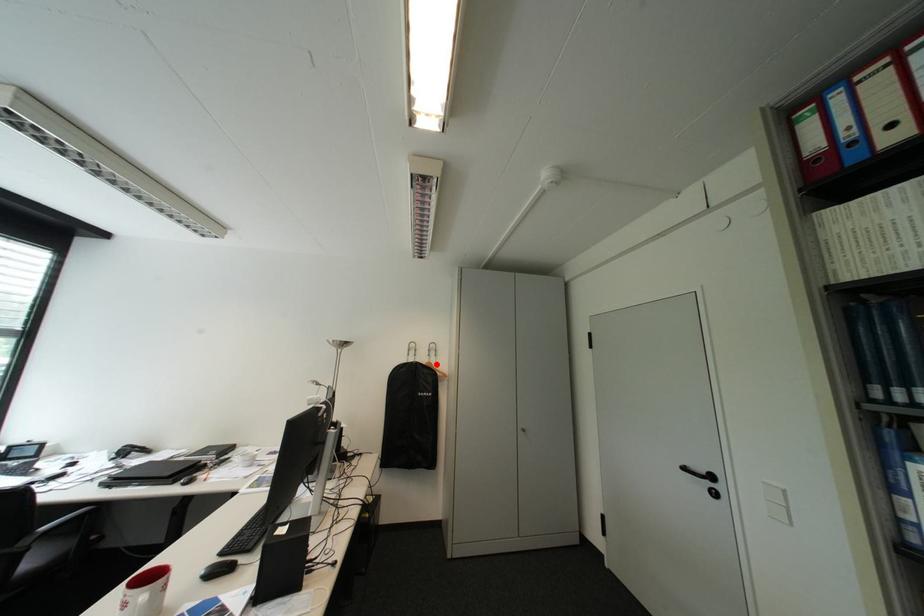
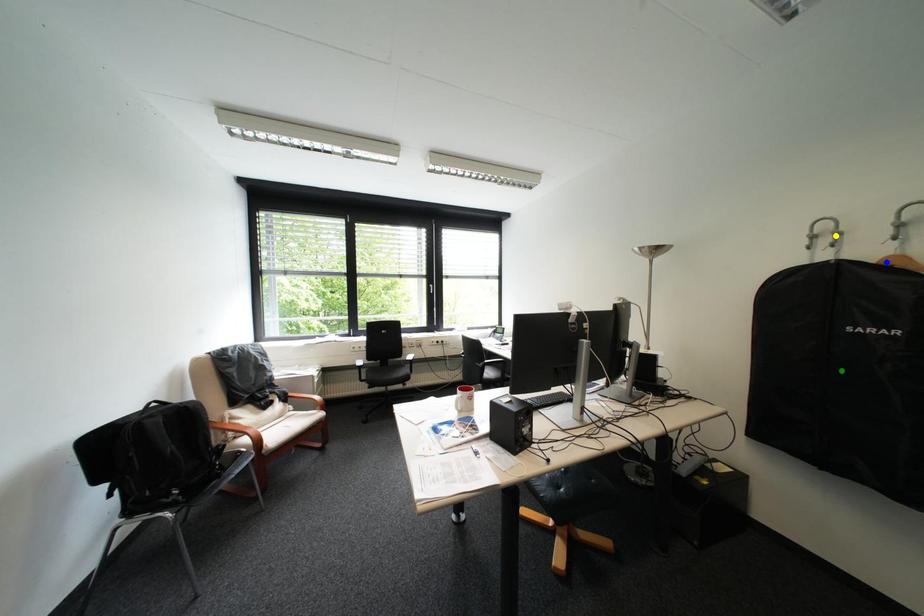
Question: I am providing you with two images of the same scene from different viewpoints. A red point is marked on the first image. You are given multiple points on the second image. Which spot in image 2 lines up with the point in image 1?

Choices:
 (A) green point
 (B) yellow point
 (C) blue point

Answer: (C)